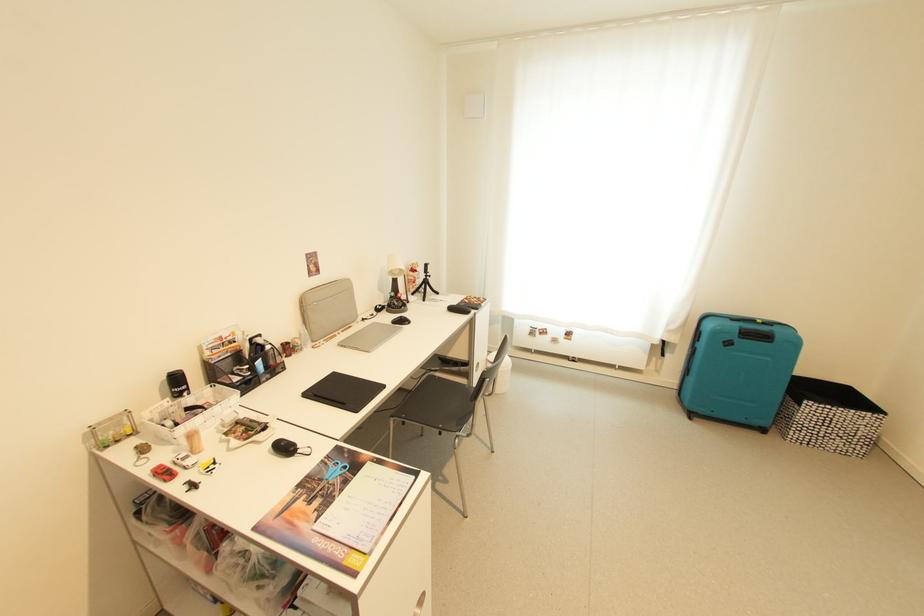
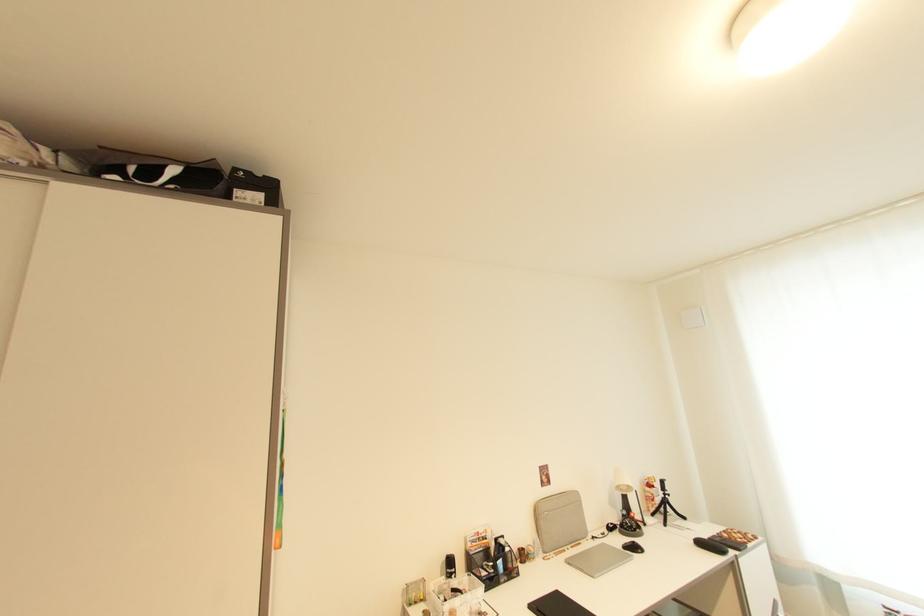
Find the pixel in the second image that matches the point at 402,274 in the first image.

(629, 490)